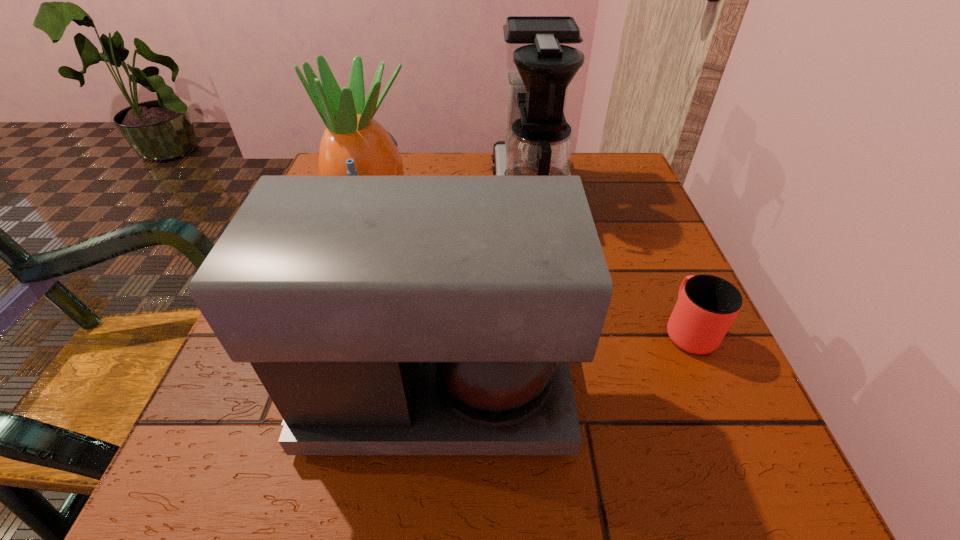
You are a GUI agent. You are given a task and a screenshot of the screen. Output one action in this format:
    pyautogui.click(x=<x>, y=<y>)
    Task: Click on the free space that satisfies the following two spatial constraints: 1. at the front of the farther coffee maker where the controls are located; 2. on the handle side of the rightmost object
    
    Given the screenshot: What is the action you would take?
    pyautogui.click(x=551, y=329)

At what (x,y) coordinates should I click in order to perform the action: click on vacant space that satisfies the following two spatial constraints: 1. on the handle side of the rightmost object; 2. at the front of the farther coffee maker where the controls are located. Please return your answer as a coordinate pair (x, y). Looking at the image, I should click on (628, 191).

At what (x,y) coordinates should I click in order to perform the action: click on vacant position in the image that satisfies the following two spatial constraints: 1. at the entrance of the pineapple; 2. on the handle side of the cup. Please return your answer as a coordinate pair (x, y). The width and height of the screenshot is (960, 540). Looking at the image, I should click on (339, 329).

Find the location of a particular element. vacant region that satisfies the following two spatial constraints: 1. at the front of the farther coffee maker where the controls are located; 2. on the handle side of the cup is located at coordinates (551, 329).

Where is `free space that satisfies the following two spatial constraints: 1. at the front of the farther coffee maker where the controls are located; 2. on the handle side of the shortest object`? Image resolution: width=960 pixels, height=540 pixels. free space that satisfies the following two spatial constraints: 1. at the front of the farther coffee maker where the controls are located; 2. on the handle side of the shortest object is located at coordinates (551, 329).

Identify the location of vacant space that satisfies the following two spatial constraints: 1. on the handle side of the shortest object; 2. at the front of the farther coffee maker where the controls are located. This screenshot has height=540, width=960. (628, 191).